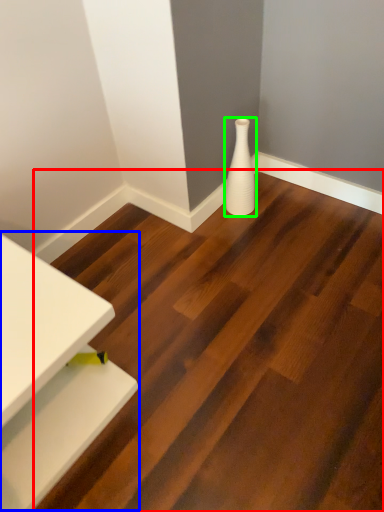
Question: Which object is positioned closest to stair (highlighted by a red box)? Select from table (highlighted by a blue box) and vase (highlighted by a green box).

Choices:
 (A) table
 (B) vase

Answer: (A)